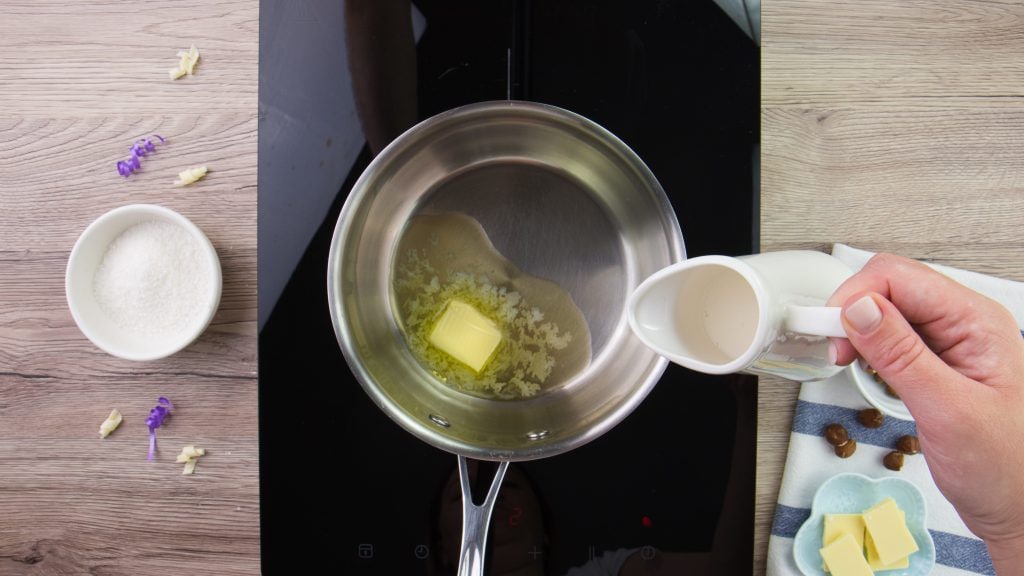
Identify the location of wooden table top. (897, 159).